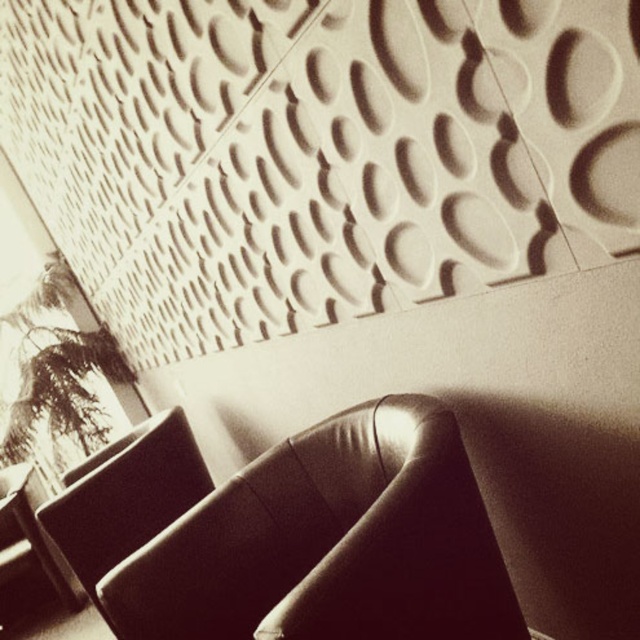
Can you confirm if leather armchair at center is bigger than leather at left?

Incorrect, leather armchair at center is not larger than leather at left.

Consider the image. Between leather armchair at center and leather at left, which one appears on the left side from the viewer's perspective?

Positioned to the left is leather at left.

Does point (349, 620) come farther from viewer compared to point (84, 556)?

No, (349, 620) is closer to viewer.

Find the location of a particular element. leather armchair at center is located at coordinates (330, 541).